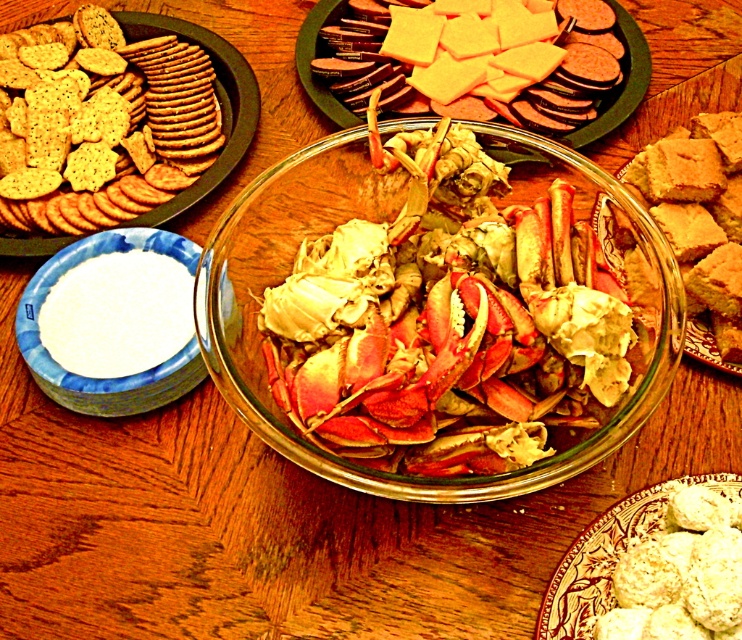
Question: Which object is the closest to the white crumbly at lower right?

Choices:
 (A) white paper bowl at lower left
 (B) matte brown crackers at upper center

Answer: (A)

Question: Is shiny red crab at center closer to the viewer compared to golden brown crumbly square at right?

Choices:
 (A) yes
 (B) no

Answer: (A)

Question: Estimate the real-world distances between objects in this image. Which object is farther from the white crumbly at lower right?

Choices:
 (A) golden brown crumbly square at right
 (B) matte brown crackers at upper center

Answer: (B)

Question: Can you confirm if golden brown crumbly square at right is bigger than white paper bowl at lower left?

Choices:
 (A) no
 (B) yes

Answer: (B)

Question: Based on their relative distances, which object is farther from the matte brown crackers at left?

Choices:
 (A) shiny red crab at center
 (B) golden brown crumbly square at right
 (C) white crumbly at lower right

Answer: (C)

Question: Can you confirm if white paper bowl at lower left is positioned to the left of white crumbly at lower right?

Choices:
 (A) no
 (B) yes

Answer: (B)